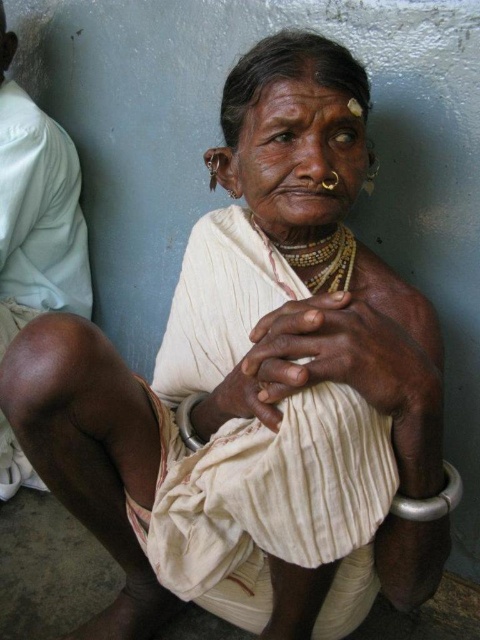
Does brown skin at lower left appear under gold beaded necklace at center?

Incorrect, brown skin at lower left is not positioned below gold beaded necklace at center.

Can you confirm if brown skin at lower left is positioned to the left of gold beaded necklace at center?

Correct, you'll find brown skin at lower left to the left of gold beaded necklace at center.

At what (x,y) coordinates should I click in order to perform the action: click on brown skin at lower left. Please return your answer as a coordinate pair (x, y). The height and width of the screenshot is (640, 480). Looking at the image, I should click on (36, 209).

Can you confirm if brown skin at lower left is shorter than silver metallic bracelet at lower center?

Incorrect, brown skin at lower left's height does not fall short of silver metallic bracelet at lower center's.

Is brown skin at lower left positioned before silver metallic bracelet at lower center?

No.

Which is behind, point (27, 252) or point (180, 406)?

Point (27, 252)

Find the location of a particular element. The height and width of the screenshot is (640, 480). brown skin at lower left is located at coordinates (36, 209).

Does gold beaded necklace at center have a lesser height compared to dry skin at center?

No, gold beaded necklace at center is not shorter than dry skin at center.

Consider the image. Is gold beaded necklace at center positioned before dry skin at center?

No.

Find the location of a particular element. The width and height of the screenshot is (480, 640). gold beaded necklace at center is located at coordinates (325, 260).